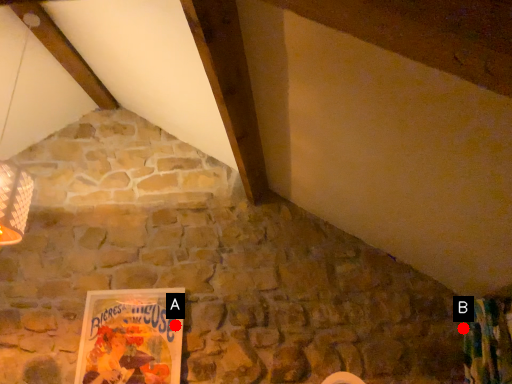
Question: Two points are circled on the image, labeled by A and B beside each circle. Among these points, which one is nearest to the camera?

Choices:
 (A) A is closer
 (B) B is closer

Answer: (B)